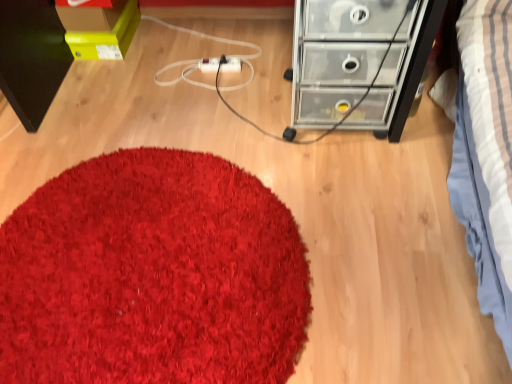
Question: Can you see white plastic extension cord at center touching transparent plastic chest of drawers at upper right?

Choices:
 (A) yes
 (B) no

Answer: (B)

Question: Does white plastic extension cord at center turn towards transparent plastic chest of drawers at upper right?

Choices:
 (A) yes
 (B) no

Answer: (B)

Question: Can you confirm if white plastic extension cord at center is thinner than transparent plastic chest of drawers at upper right?

Choices:
 (A) yes
 (B) no

Answer: (A)

Question: Is white plastic extension cord at center outside of transparent plastic chest of drawers at upper right?

Choices:
 (A) yes
 (B) no

Answer: (A)

Question: Is white plastic extension cord at center far from transparent plastic chest of drawers at upper right?

Choices:
 (A) yes
 (B) no

Answer: (B)

Question: Is white plastic extension cord at center bigger than transparent plastic chest of drawers at upper right?

Choices:
 (A) no
 (B) yes

Answer: (A)

Question: Is white plastic extension cord at center shorter than shaggy red carpet at center?

Choices:
 (A) no
 (B) yes

Answer: (A)

Question: From the image's perspective, is white plastic extension cord at center on top of shaggy red carpet at center?

Choices:
 (A) no
 (B) yes

Answer: (B)

Question: Considering the relative sizes of white plastic extension cord at center and shaggy red carpet at center in the image provided, is white plastic extension cord at center thinner than shaggy red carpet at center?

Choices:
 (A) no
 (B) yes

Answer: (B)

Question: Would you say white plastic extension cord at center is a long distance from shaggy red carpet at center?

Choices:
 (A) no
 (B) yes

Answer: (A)

Question: Considering the relative positions of white plastic extension cord at center and shaggy red carpet at center in the image provided, is white plastic extension cord at center to the right of shaggy red carpet at center from the viewer's perspective?

Choices:
 (A) yes
 (B) no

Answer: (A)

Question: Is white plastic extension cord at center bigger than shaggy red carpet at center?

Choices:
 (A) no
 (B) yes

Answer: (A)

Question: From a real-world perspective, is transparent plastic chest of drawers at upper right over shaggy red carpet at center?

Choices:
 (A) yes
 (B) no

Answer: (A)